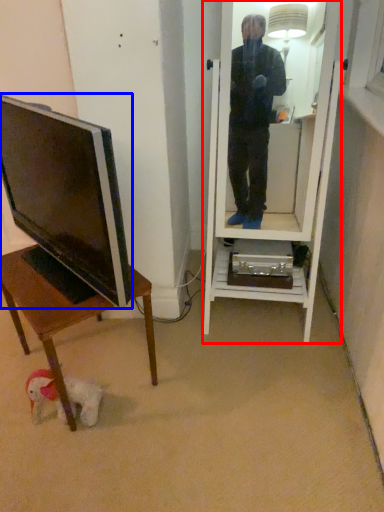
Question: Which object is closer to the camera taking this photo, mirror (highlighted by a red box) or television (highlighted by a blue box)?

Choices:
 (A) mirror
 (B) television

Answer: (B)